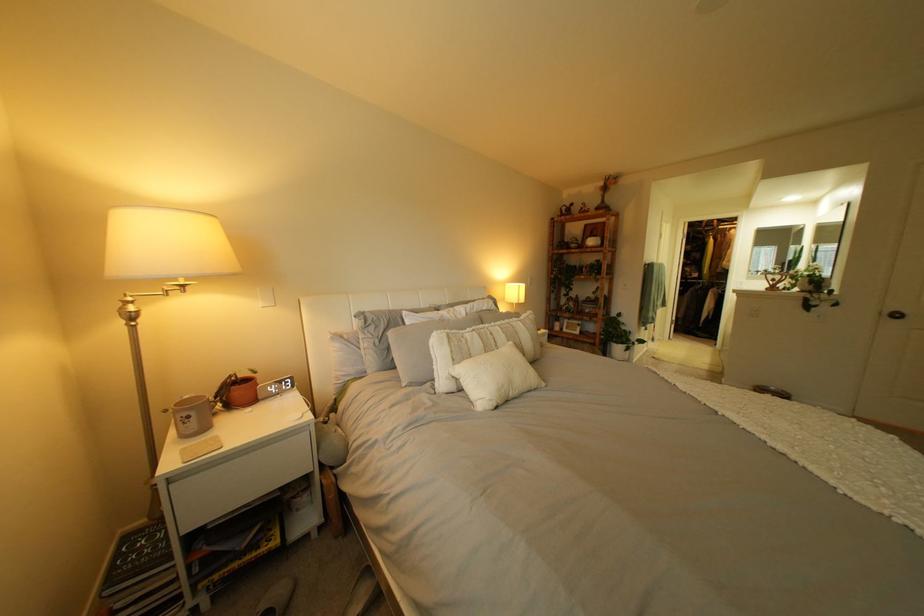
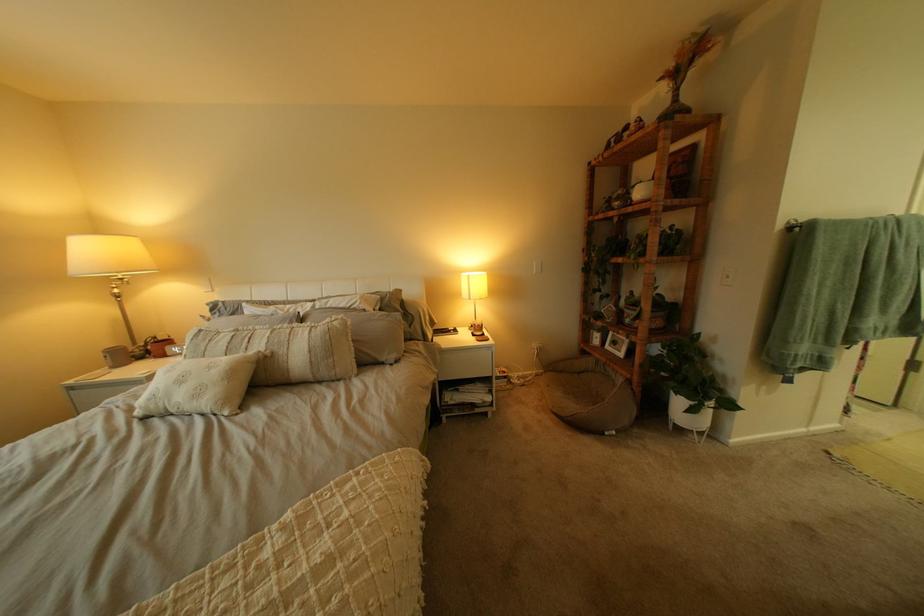
Locate, in the second image, the point that corresponds to (535,286) in the first image.

(483, 277)